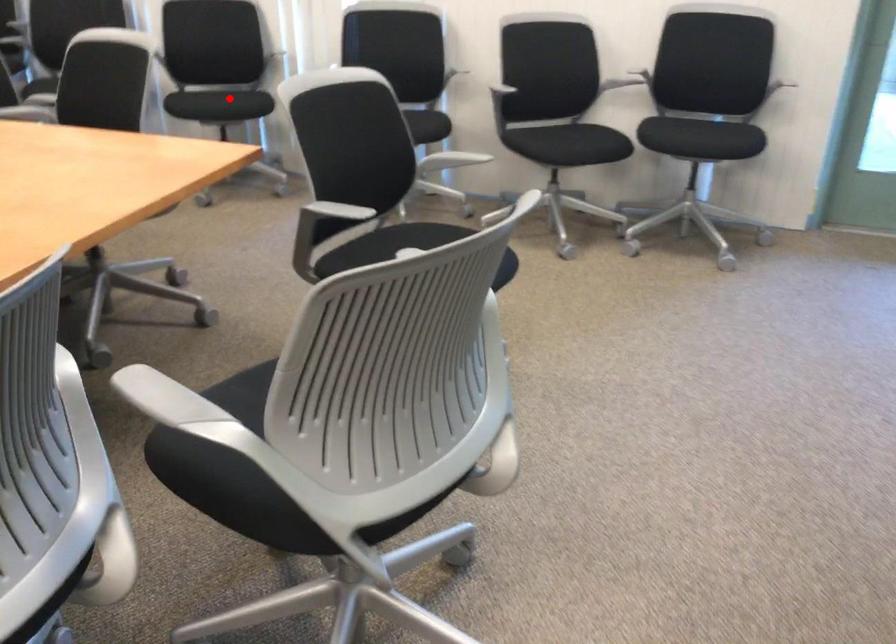
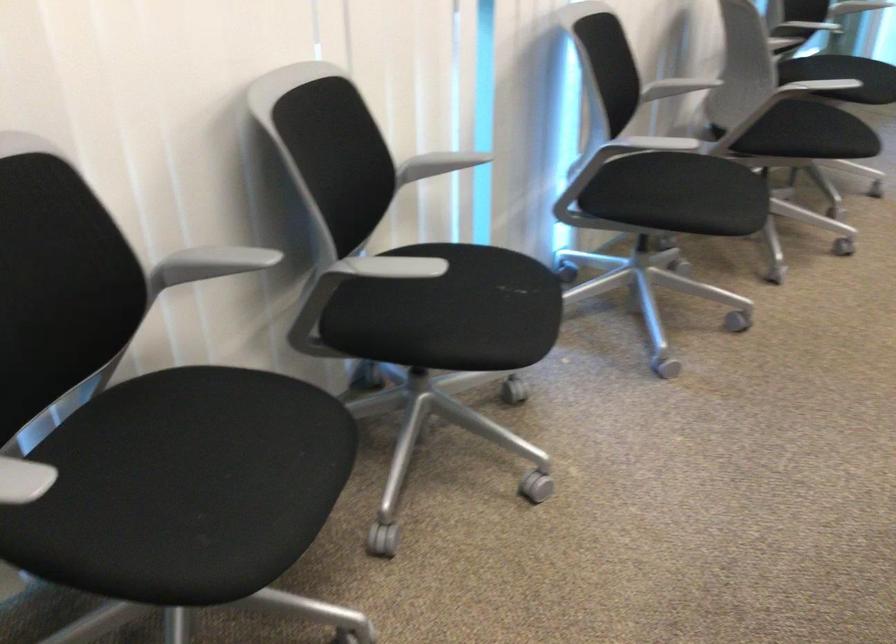
Question: I am providing you with two images of the same scene from different viewpoints. In image1, a red point is highlighted. Considering the same 3D point in image2, which of the following is correct?

Choices:
 (A) It is closer
 (B) It is farther

Answer: (A)